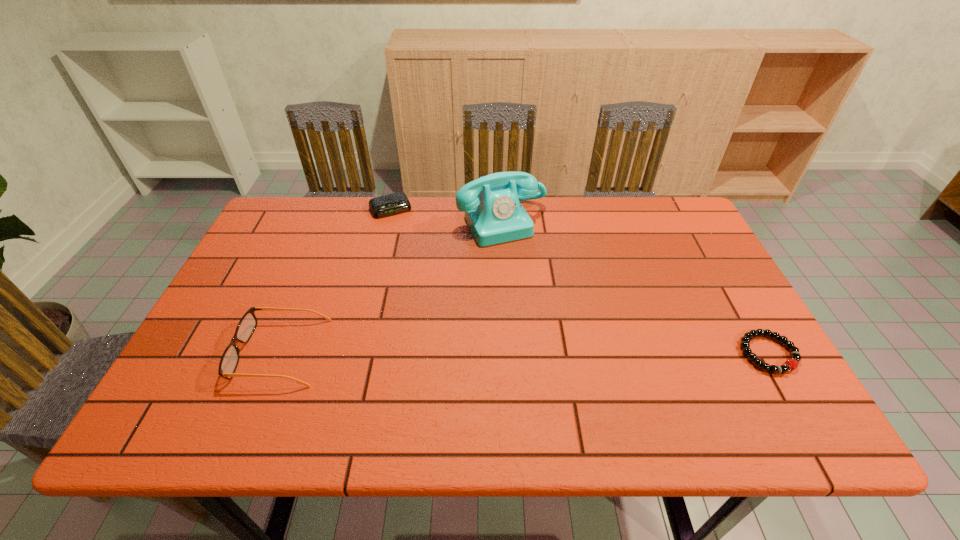
This screenshot has height=540, width=960. In order to click on spectacles located at the near edge in this screenshot , I will do point(229,361).

Where is `bracelet at the near edge`? The image size is (960, 540). bracelet at the near edge is located at coordinates (791, 364).

Locate an element on the screen. object that is positioned at the left edge is located at coordinates (229, 361).

Find the location of a particular element. object located at the right edge is located at coordinates (791, 364).

Where is `object located in the near left corner section of the desktop`? Image resolution: width=960 pixels, height=540 pixels. object located in the near left corner section of the desktop is located at coordinates (229, 361).

Identify the location of object situated at the near right corner. pos(791,364).

At what (x,y) coordinates should I click in order to perform the action: click on free space at the far edge of the desktop. Please return your answer as a coordinate pair (x, y). The image size is (960, 540). Looking at the image, I should click on (396, 223).

The image size is (960, 540). Identify the location of vacant space at the near edge of the desktop. click(321, 374).

Where is `free space at the left edge of the desktop`? free space at the left edge of the desktop is located at coordinates (300, 264).

You are a GUI agent. You are given a task and a screenshot of the screen. Output one action in this format:
    pyautogui.click(x=<x>, y=<y>)
    Task: Click on the blank area at the far left corner
    This screenshot has width=960, height=540.
    Given the screenshot: What is the action you would take?
    pyautogui.click(x=309, y=212)